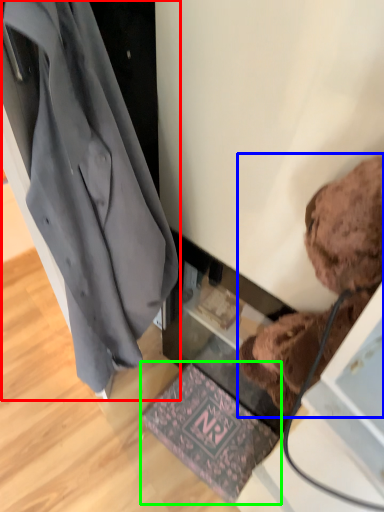
Question: Which is farther away from coat (highlighted by a red box)? teddy bear (highlighted by a blue box) or mat (highlighted by a green box)?

Choices:
 (A) teddy bear
 (B) mat

Answer: (B)